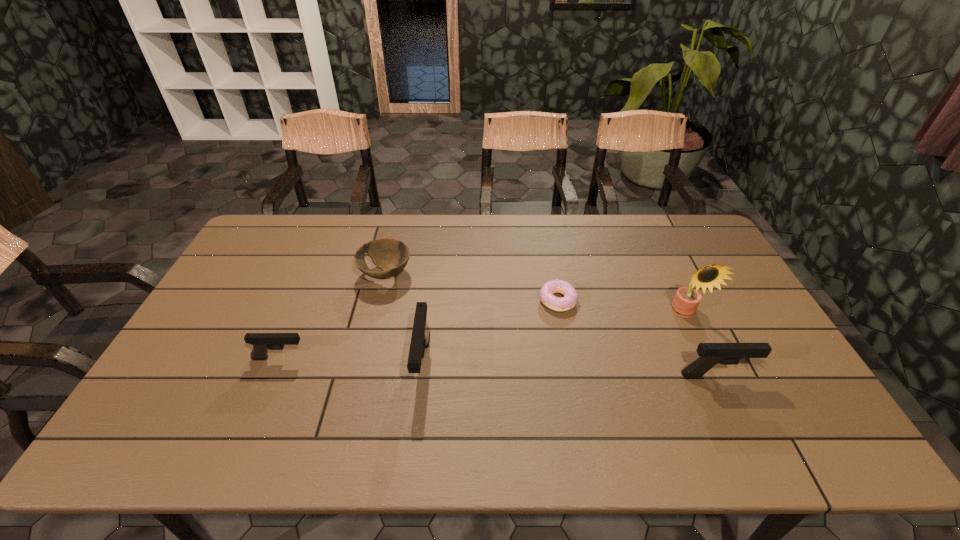
Image resolution: width=960 pixels, height=540 pixels. I want to click on free spot at the right edge of the desktop, so click(690, 258).

At what (x,y) coordinates should I click in order to perform the action: click on vacant area at the far left corner. Please return your answer as a coordinate pair (x, y). The width and height of the screenshot is (960, 540). Looking at the image, I should click on (276, 222).

At what (x,y) coordinates should I click in order to perform the action: click on vacant space at the near left corner of the desktop. Please return your answer as a coordinate pair (x, y). The height and width of the screenshot is (540, 960). Looking at the image, I should click on (151, 408).

Locate an element on the screen. The height and width of the screenshot is (540, 960). vacant area that lies between the third tallest object and the bowl is located at coordinates (551, 325).

The height and width of the screenshot is (540, 960). I want to click on free area in between the tallest object and the doughnut, so click(621, 307).

Image resolution: width=960 pixels, height=540 pixels. What are the coordinates of `free space between the rightmost pistol and the shortest object` in the screenshot? It's located at (637, 338).

Find the location of `blank region between the second tallest object and the leftmost pistol`. blank region between the second tallest object and the leftmost pistol is located at coordinates [351, 361].

Locate an element on the screen. The width and height of the screenshot is (960, 540). free spot between the doughnut and the second object from left to right is located at coordinates (471, 288).

What are the coordinates of `free spot between the second shortest pistol and the shortest object` in the screenshot? It's located at (637, 338).

Find the location of a particular element. This screenshot has height=540, width=960. free spot between the third tallest object and the fifth object from right to left is located at coordinates (x=551, y=325).